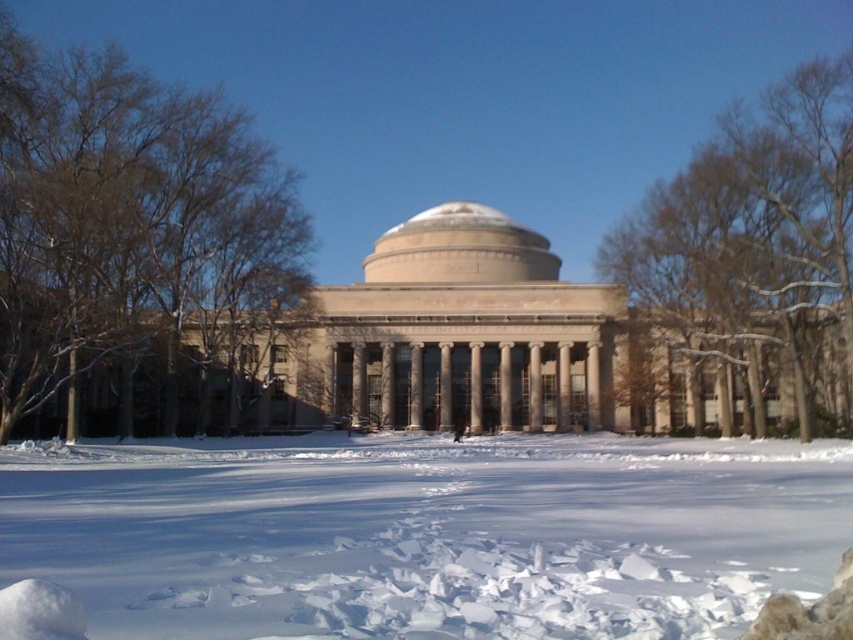
Question: Among these objects, which one is farthest from the camera?

Choices:
 (A) beige stone dome at center
 (B) brown leafless tree at upper right
 (C) white powdery snow at center
 (D) brown leafless tree at upper left

Answer: (A)

Question: Estimate the real-world distances between objects in this image. Which object is closer to the brown leafless tree at upper left?

Choices:
 (A) white powdery snow at center
 (B) brown leafless tree at upper right

Answer: (A)

Question: Is white powdery snow at center to the left of beige stone dome at center from the viewer's perspective?

Choices:
 (A) no
 (B) yes

Answer: (A)

Question: Can you confirm if brown leafless tree at upper left is positioned above brown leafless tree at upper right?

Choices:
 (A) no
 (B) yes

Answer: (B)

Question: Is brown leafless tree at upper right to the right of beige stone dome at center from the viewer's perspective?

Choices:
 (A) yes
 (B) no

Answer: (A)

Question: Which object appears farthest from the camera in this image?

Choices:
 (A) brown leafless tree at upper right
 (B) brown leafless tree at upper left
 (C) white powdery snow at center

Answer: (A)